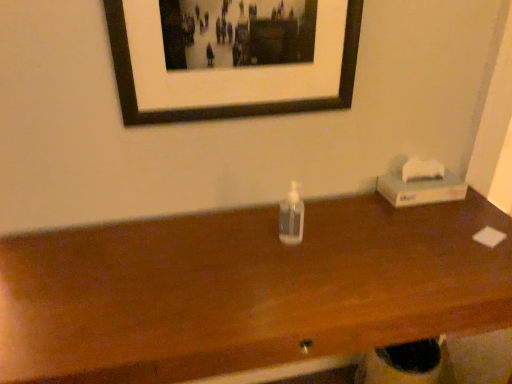
Describe the element at coordinates (228, 106) in the screenshot. The height and width of the screenshot is (384, 512). I see `black matte picture frame at upper center` at that location.

The height and width of the screenshot is (384, 512). Describe the element at coordinates (245, 290) in the screenshot. I see `transparent plastic bottle at center` at that location.

At what (x,y) coordinates should I click in order to perform the action: click on transparent plastic bottle at center. Please return your answer as a coordinate pair (x, y). Looking at the image, I should click on pos(291,217).

Where is `white cardboard tissue box at right`? This screenshot has width=512, height=384. white cardboard tissue box at right is located at coordinates (421, 184).

Measure the distance between white cardboard tissue box at right and camera.

white cardboard tissue box at right and camera are 4.01 feet apart.

The image size is (512, 384). I want to click on black matte picture frame at upper center, so click(x=228, y=106).

Does transparent plastic bottle at center have a smaller size compared to white cardboard tissue box at right?

Incorrect, transparent plastic bottle at center is not smaller in size than white cardboard tissue box at right.

Is transparent plastic bottle at center in front of or behind white cardboard tissue box at right in the image?

In the image, transparent plastic bottle at center appears in front of white cardboard tissue box at right.

From a real-world perspective, which is physically above, transparent plastic bottle at center or white cardboard tissue box at right?

white cardboard tissue box at right is physically above.

Which is closer, (401, 179) or (131, 122)?

The point (131, 122) is in front.

Are white cardboard tissue box at right and black matte picture frame at upper center located far from each other?

That's not correct — white cardboard tissue box at right is a little close to black matte picture frame at upper center.

Is white cardboard tissue box at right positioned behind black matte picture frame at upper center?

That is True.

Would you say white cardboard tissue box at right is a long distance from transparent plastic bottle at center?

white cardboard tissue box at right is actually quite close to transparent plastic bottle at center.

In the scene shown: From the image's perspective, does white cardboard tissue box at right appear lower than transparent plastic bottle at center?

No, from the image's perspective, white cardboard tissue box at right is not below transparent plastic bottle at center.

Based on their sizes in the image, would you say white cardboard tissue box at right is bigger or smaller than transparent plastic bottle at center?

Clearly, white cardboard tissue box at right is larger in size than transparent plastic bottle at center.

Considering the positions of objects black matte picture frame at upper center and white cardboard tissue box at right in the image provided, who is behind, black matte picture frame at upper center or white cardboard tissue box at right?

white cardboard tissue box at right is behind.

Is black matte picture frame at upper center oriented away from white cardboard tissue box at right?

No, white cardboard tissue box at right is not at the back of black matte picture frame at upper center.

Considering the relative positions of black matte picture frame at upper center and white cardboard tissue box at right in the image provided, is black matte picture frame at upper center to the left or to the right of white cardboard tissue box at right?

In the image, black matte picture frame at upper center appears on the left side of white cardboard tissue box at right.

From a real-world perspective, is black matte picture frame at upper center on white cardboard tissue box at right?

Yes, from a real-world perspective, black matte picture frame at upper center is on top of white cardboard tissue box at right.

How distant is transparent plastic bottle at center from transparent plastic bottle at center?

transparent plastic bottle at center is 11.57 inches from transparent plastic bottle at center.

Does transparent plastic bottle at center turn towards transparent plastic bottle at center?

No, transparent plastic bottle at center is not aimed at transparent plastic bottle at center.

Considering the sizes of objects transparent plastic bottle at center and transparent plastic bottle at center in the image provided, who is thinner, transparent plastic bottle at center or transparent plastic bottle at center?

Thinner between the two is transparent plastic bottle at center.

In the image, is transparent plastic bottle at center positioned in front of or behind transparent plastic bottle at center?

In the image, transparent plastic bottle at center appears behind transparent plastic bottle at center.

Considering the sizes of objects transparent plastic bottle at center and black matte picture frame at upper center in the image provided, who is taller, transparent plastic bottle at center or black matte picture frame at upper center?

Standing taller between the two is black matte picture frame at upper center.

From the image's perspective, which object appears higher, transparent plastic bottle at center or black matte picture frame at upper center?

black matte picture frame at upper center is shown above in the image.

Is transparent plastic bottle at center oriented towards black matte picture frame at upper center?

No.

Does point (291, 224) come farther from viewer compared to point (164, 120)?

Yes, point (291, 224) is behind point (164, 120).

Does transparent plastic bottle at center lie behind white cardboard tissue box at right?

No, transparent plastic bottle at center is closer to the viewer.

What's the angular difference between transparent plastic bottle at center and white cardboard tissue box at right's facing directions?

transparent plastic bottle at center and white cardboard tissue box at right are facing 0.658 degrees away from each other.

Between point (298, 220) and point (406, 188), which one is positioned in front?

Positioned in front is point (298, 220).

Would you say transparent plastic bottle at center is to the left or to the right of white cardboard tissue box at right in the picture?

From the image, it's evident that transparent plastic bottle at center is to the left of white cardboard tissue box at right.

Locate an element on the screen. table in front of the white cardboard tissue box at right is located at coordinates (245, 290).

You are a GUI agent. You are given a task and a screenshot of the screen. Output one action in this format:
    pyautogui.click(x=<x>, y=<y>)
    Task: Click on the box that appears behind the black matte picture frame at upper center
    Image resolution: width=512 pixels, height=384 pixels.
    Given the screenshot: What is the action you would take?
    pyautogui.click(x=421, y=184)

Estimate the real-world distances between objects in this image. Which object is closer to black matte picture frame at upper center, white cardboard tissue box at right or transparent plastic bottle at center?

transparent plastic bottle at center lies closer to black matte picture frame at upper center than the other object.

From the picture: When comparing their distances from black matte picture frame at upper center, does transparent plastic bottle at center or white cardboard tissue box at right seem further?

transparent plastic bottle at center is positioned further to the anchor black matte picture frame at upper center.

From the image, which object appears to be farther from transparent plastic bottle at center, white cardboard tissue box at right or black matte picture frame at upper center?

The object further to transparent plastic bottle at center is white cardboard tissue box at right.

Which object lies nearer to the anchor point black matte picture frame at upper center, white cardboard tissue box at right or transparent plastic bottle at center?

white cardboard tissue box at right lies closer to black matte picture frame at upper center than the other object.

Based on their spatial positions, is transparent plastic bottle at center or black matte picture frame at upper center further from transparent plastic bottle at center?

Based on the image, black matte picture frame at upper center appears to be further to transparent plastic bottle at center.

From the picture: Estimate the real-world distances between objects in this image. Which object is further from transparent plastic bottle at center, black matte picture frame at upper center or white cardboard tissue box at right?

black matte picture frame at upper center lies further to transparent plastic bottle at center than the other object.

Looking at the image, which one is located closer to white cardboard tissue box at right, transparent plastic bottle at center or transparent plastic bottle at center?

Among the two, transparent plastic bottle at center is located nearer to white cardboard tissue box at right.

Estimate the real-world distances between objects in this image. Which object is further from black matte picture frame at upper center, transparent plastic bottle at center or white cardboard tissue box at right?

white cardboard tissue box at right is further to black matte picture frame at upper center.

The width and height of the screenshot is (512, 384). I want to click on bottle located between black matte picture frame at upper center and white cardboard tissue box at right in the left-right direction, so click(x=291, y=217).

Locate an element on the screen. This screenshot has height=384, width=512. bottle between black matte picture frame at upper center and transparent plastic bottle at center from top to bottom is located at coordinates (291, 217).

I want to click on bottle between white cardboard tissue box at right and transparent plastic bottle at center from top to bottom, so click(291, 217).

You are a GUI agent. You are given a task and a screenshot of the screen. Output one action in this format:
    pyautogui.click(x=<x>, y=<y>)
    Task: Click on the box between black matte picture frame at upper center and transparent plastic bottle at center vertically
    Image resolution: width=512 pixels, height=384 pixels.
    Given the screenshot: What is the action you would take?
    pyautogui.click(x=421, y=184)